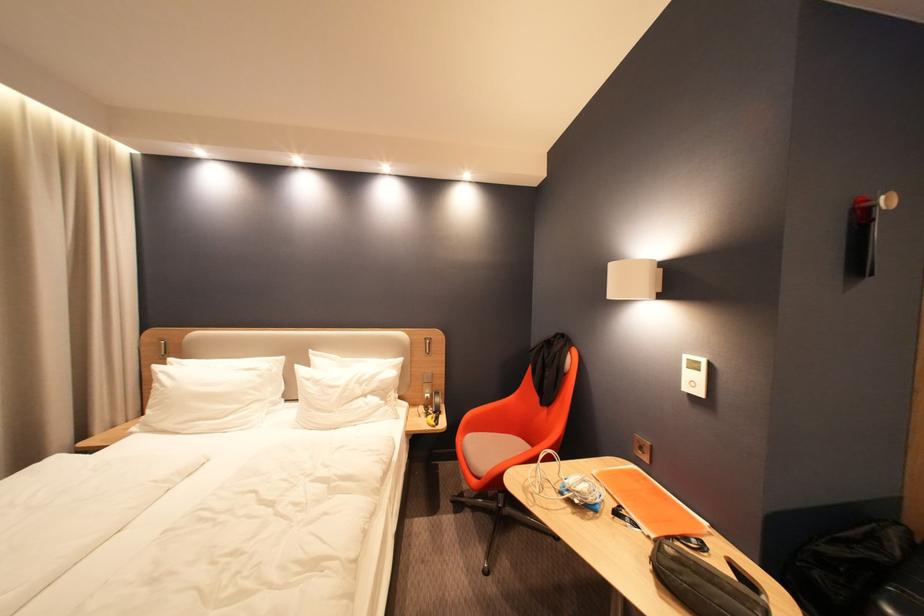
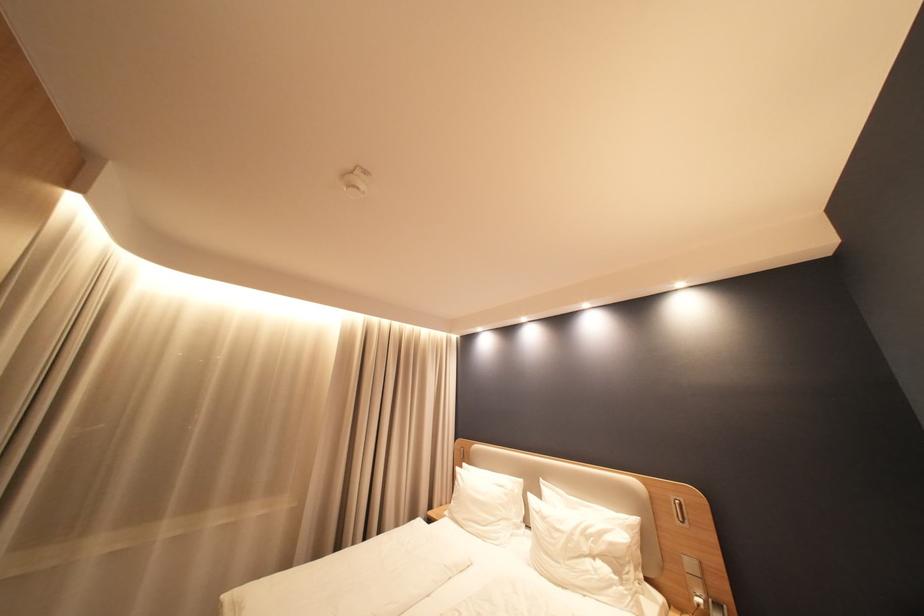
Where in the second image is the point corresponding to pixel 172 373 from the first image?

(468, 475)